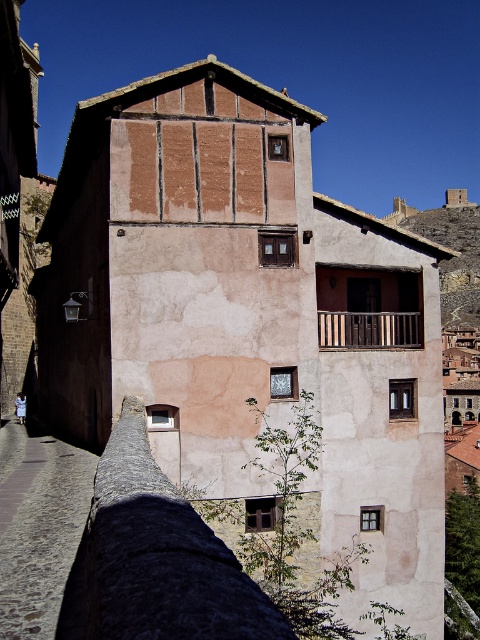
Can you confirm if cobblestone alley at lower left is taller than wooden at center?

No, cobblestone alley at lower left is not taller than wooden at center.

Who is taller, cobblestone alley at lower left or wooden at center?

With more height is wooden at center.

Describe the element at coordinates (38, 525) in the screenshot. The image size is (480, 640). I see `cobblestone alley at lower left` at that location.

I want to click on cobblestone alley at lower left, so click(38, 525).